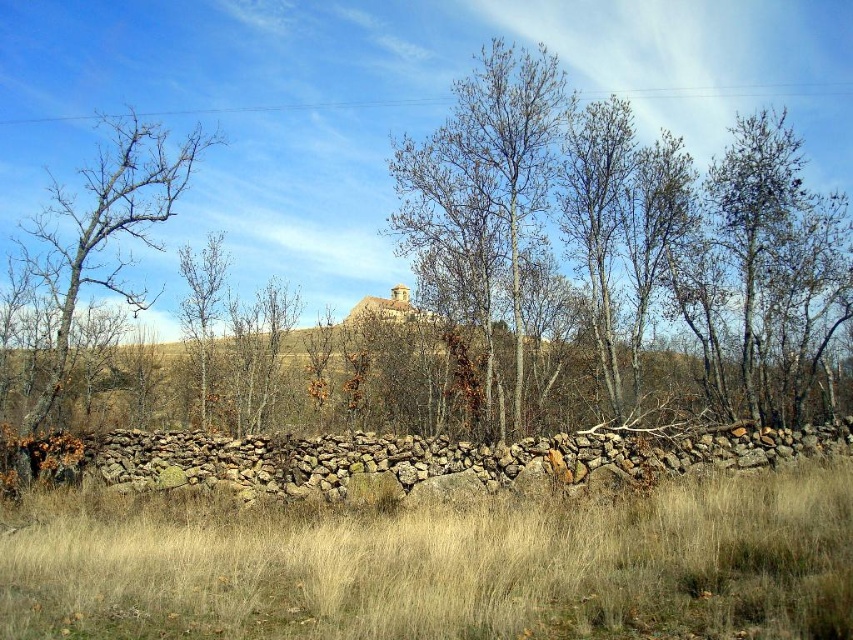
Question: Where is dry grass at lower center located in relation to bare wood tree at left in the image?

Choices:
 (A) right
 (B) left

Answer: (A)

Question: Which of the following is the farthest from the observer?

Choices:
 (A) pos(492,196)
 (B) pos(131,166)

Answer: (A)

Question: Which of these objects is positioned farthest from the brown bark tree at left?

Choices:
 (A) bare wood tree at left
 (B) dry grass at lower center

Answer: (B)

Question: Is dry grass at lower center to the left of bare wood tree at left from the viewer's perspective?

Choices:
 (A) no
 (B) yes

Answer: (A)

Question: Considering the real-world distances, which object is closest to the bare wood tree at center?

Choices:
 (A) dry grass at lower center
 (B) bare wood tree at left
 (C) brown bark tree at left

Answer: (A)

Question: Is dry grass at lower center positioned before brown bark tree at left?

Choices:
 (A) no
 (B) yes

Answer: (B)